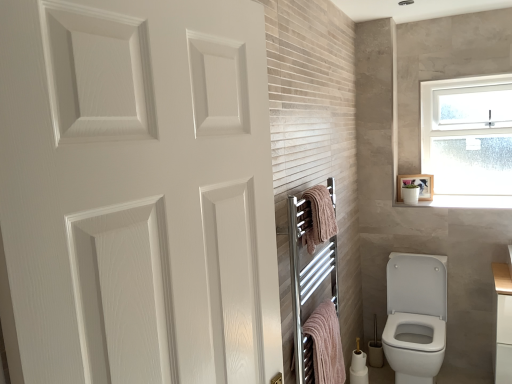
Question: Does point (106, 322) appear closer or farther from the camera than point (357, 367)?

Choices:
 (A) farther
 (B) closer

Answer: (B)

Question: Considering their positions, is white matte door at upper left located in front of or behind white glossy toilet paper at lower right, which is the first toilet paper from bottom to top?

Choices:
 (A) front
 (B) behind

Answer: (A)

Question: Considering the real-world distances, which object is farthest from the white matte door at upper left?

Choices:
 (A) white ceramic window sill at upper right
 (B) white glossy medicine cabinet at upper right
 (C) white glossy toilet at lower right
 (D) white frosted glass window at upper right
 (E) pink fabric towel at center-right, arranged as the 2th bath towel when viewed from the top

Answer: (D)

Question: Estimate the real-world distances between objects in this image. Which object is closer to the chrome towel rack at center?

Choices:
 (A) white glossy toilet paper at lower right, the 1th toilet paper from the top
 (B) white frosted glass window at upper right
 (C) white glossy medicine cabinet at upper right
 (D) white ceramic window sill at upper right
 (E) pink fabric towel at center-right, which is counted as the first bath towel, starting from the bottom

Answer: (E)